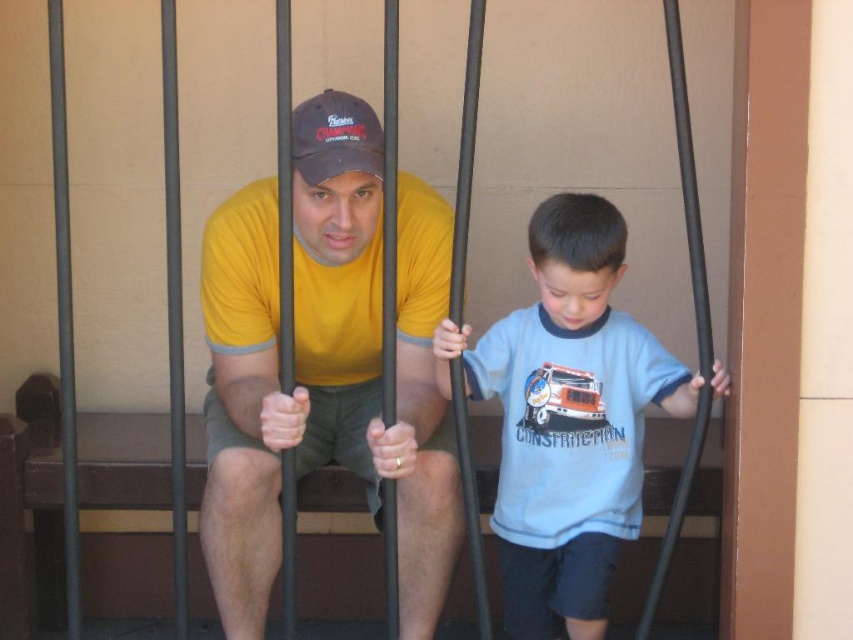
Question: Which is nearer to the yellow matte t-shirt at center?

Choices:
 (A) light blue cotton shirt at center
 (B) matte black baseball cap at center

Answer: (B)

Question: Where is light blue cotton shirt at center located in relation to matte black baseball cap at center in the image?

Choices:
 (A) right
 (B) left

Answer: (A)

Question: Can you confirm if yellow matte t-shirt at center is positioned to the right of light blue cotton shirt at center?

Choices:
 (A) no
 (B) yes

Answer: (A)

Question: Considering the relative positions of yellow matte t-shirt at center and light blue cotton shirt at center in the image provided, where is yellow matte t-shirt at center located with respect to light blue cotton shirt at center?

Choices:
 (A) right
 (B) left

Answer: (B)

Question: Which is nearer to the matte black baseball cap at center?

Choices:
 (A) yellow matte t-shirt at center
 (B) light blue cotton shirt at center

Answer: (A)

Question: Which point is closer to the camera?

Choices:
 (A) (276, 385)
 (B) (582, 620)
 (C) (293, 134)

Answer: (C)